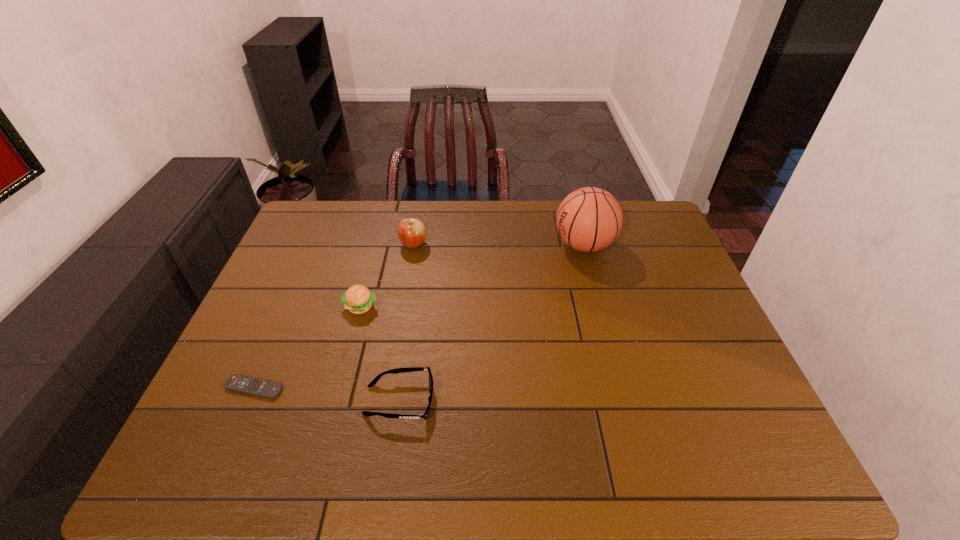
This screenshot has width=960, height=540. I want to click on vacant space at the right edge of the desktop, so click(657, 253).

Locate an element on the screen. Image resolution: width=960 pixels, height=540 pixels. free space at the near left corner of the desktop is located at coordinates (250, 446).

Image resolution: width=960 pixels, height=540 pixels. What are the coordinates of `empty space between the fourth tallest object and the leftmost object` in the screenshot? It's located at (327, 394).

You are a GUI agent. You are given a task and a screenshot of the screen. Output one action in this format:
    pyautogui.click(x=<x>, y=<y>)
    Task: Click on the empty space that is in between the fourth tallest object and the leftmost object
    
    Given the screenshot: What is the action you would take?
    pyautogui.click(x=327, y=394)

The width and height of the screenshot is (960, 540). I want to click on free space between the apple and the second object from left to right, so click(x=387, y=276).

Locate an element on the screen. vacant region between the remote control and the sunglasses is located at coordinates (327, 394).

Where is `vacant space that's between the second shortest object and the hamburger`? The width and height of the screenshot is (960, 540). vacant space that's between the second shortest object and the hamburger is located at coordinates [380, 354].

Where is `vacant area that lies between the basketball and the apple`? The height and width of the screenshot is (540, 960). vacant area that lies between the basketball and the apple is located at coordinates (499, 245).

Where is `vacant space that's between the sunglasses and the hamburger`? This screenshot has width=960, height=540. vacant space that's between the sunglasses and the hamburger is located at coordinates (380, 354).

Identify the location of empty space that is in between the sunglasses and the apple. This screenshot has height=540, width=960. (407, 323).